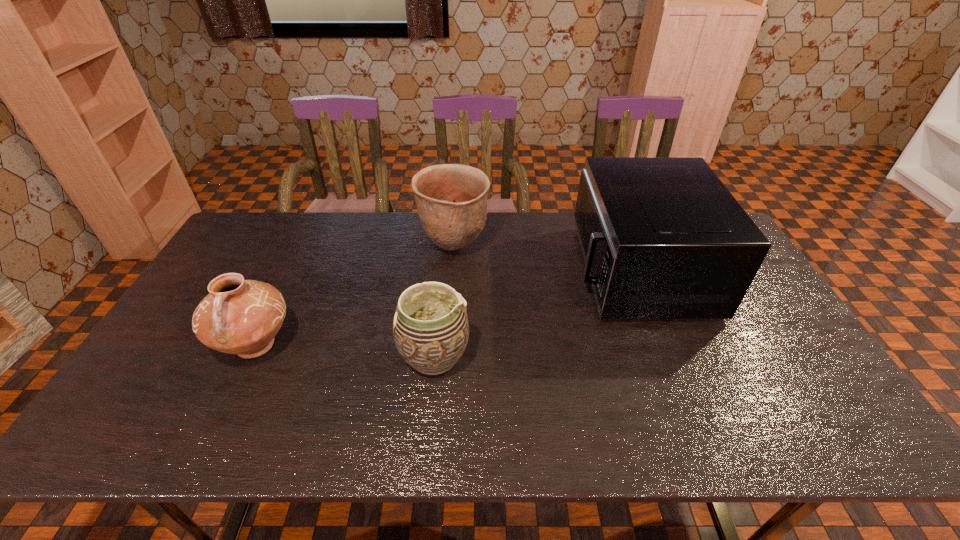
Where is `the rightmost object`? the rightmost object is located at coordinates (662, 237).

Locate an element on the screen. Image resolution: width=960 pixels, height=540 pixels. the farthest pottery is located at coordinates (451, 199).

Where is `the leftmost object`? The image size is (960, 540). the leftmost object is located at coordinates (238, 316).

The height and width of the screenshot is (540, 960). I want to click on vacant space located on the front-facing side of the microwave_oven, so click(x=475, y=271).

The width and height of the screenshot is (960, 540). Identify the location of free region located on the front-facing side of the microwave_oven. (522, 271).

You are a GUI agent. You are given a task and a screenshot of the screen. Output one action in this format:
    pyautogui.click(x=<x>, y=<y>)
    Task: Click on the vacant space situated 0.190m on the front-facing side of the microwave_oven
    Image resolution: width=960 pixels, height=540 pixels.
    Given the screenshot: What is the action you would take?
    (514, 271)

At what (x,y) coordinates should I click in order to perform the action: click on free space located on the left of the farthest pottery. Please return your answer as a coordinate pair (x, y). The image size is (960, 540). Looking at the image, I should click on (390, 247).

Where is `free space located 0.100m on the side of the leftmost pottery with the handle`? The height and width of the screenshot is (540, 960). free space located 0.100m on the side of the leftmost pottery with the handle is located at coordinates (223, 414).

Find the location of `microwave_oven positioned at the far edge`. microwave_oven positioned at the far edge is located at coordinates (662, 237).

The image size is (960, 540). In order to click on pottery located at the far edge in this screenshot , I will do `click(451, 199)`.